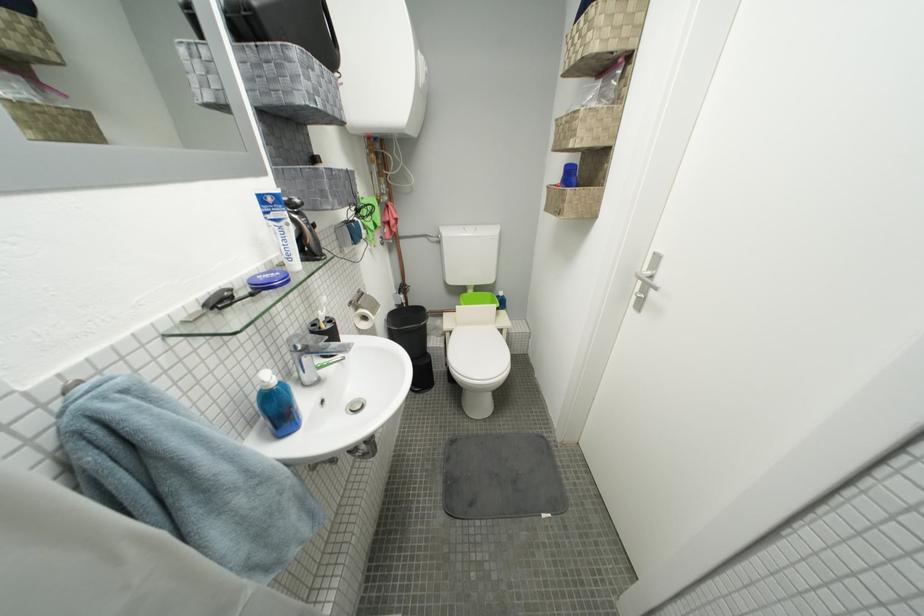
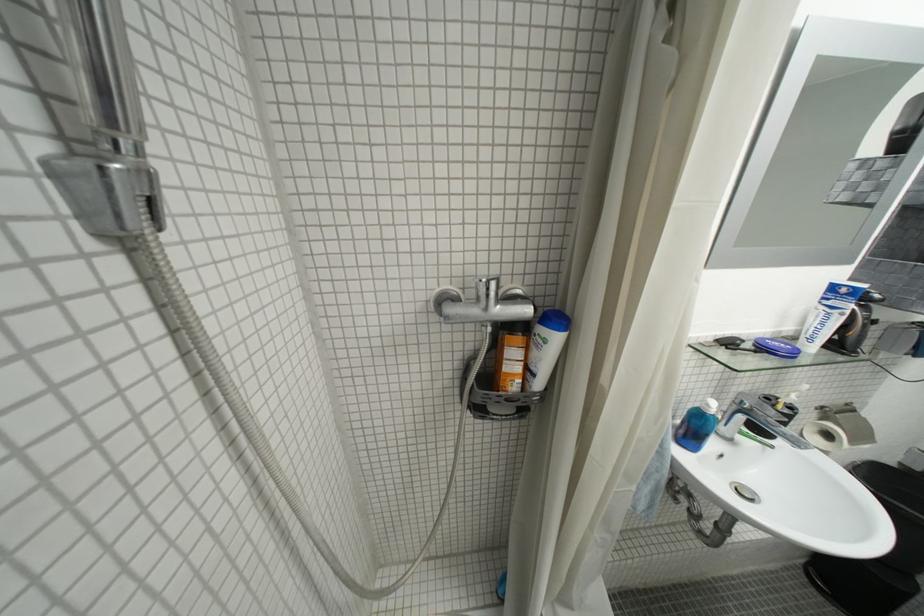
Where in the second image is the point corresponding to the point at 315,362 from the first image?

(749, 419)